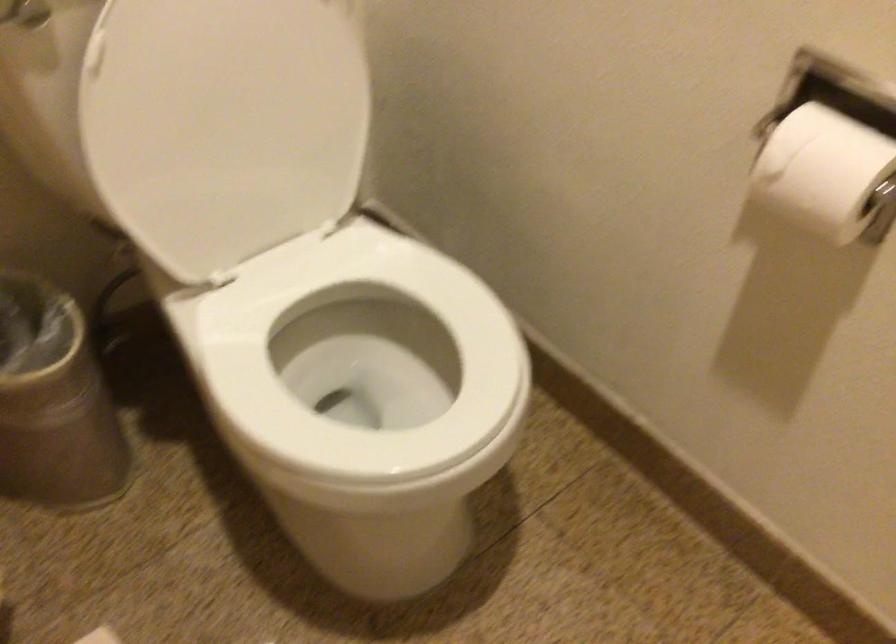
Describe the element at coordinates (239, 114) in the screenshot. I see `the white toilet lid` at that location.